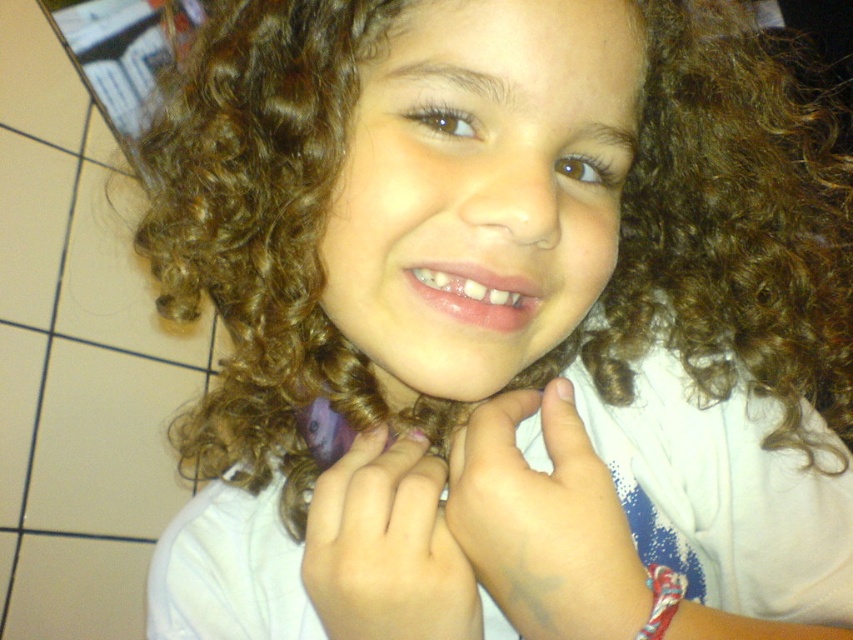
Question: Can you confirm if white matte hand at center is smaller than smooth skin hand at center?

Choices:
 (A) yes
 (B) no

Answer: (B)

Question: Is white matte hand at center below smooth skin hand at center?

Choices:
 (A) yes
 (B) no

Answer: (B)

Question: Can you confirm if white matte hand at center is thinner than smooth skin hand at center?

Choices:
 (A) no
 (B) yes

Answer: (A)